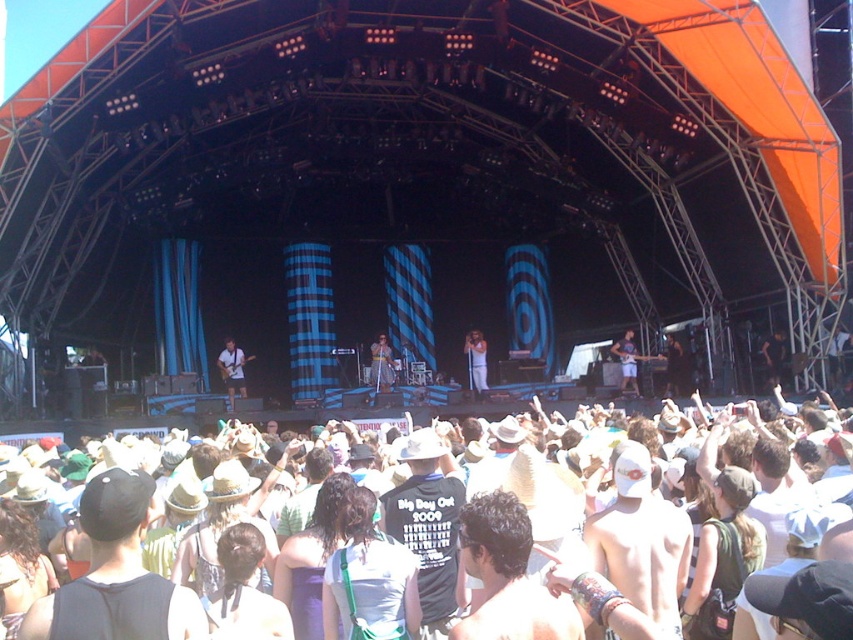
The height and width of the screenshot is (640, 853). What do you see at coordinates (231, 371) in the screenshot?
I see `matte white guitar at center` at bounding box center [231, 371].

Who is taller, matte white guitar at center or shiny silver guitar at center?

matte white guitar at center is taller.

Is point (242, 397) positioned after point (772, 362)?

No, it is in front of (772, 362).

At what (x,y) coordinates should I click in order to perform the action: click on matte white guitar at center. Please return your answer as a coordinate pair (x, y). Image resolution: width=853 pixels, height=640 pixels. Looking at the image, I should click on (231, 371).

Does white cotton crowd at center appear on the left side of white fabric shirt at center?

In fact, white cotton crowd at center is to the right of white fabric shirt at center.

Is white cotton crowd at center bigger than white fabric shirt at center?

Indeed, white cotton crowd at center has a larger size compared to white fabric shirt at center.

Image resolution: width=853 pixels, height=640 pixels. In order to click on white cotton crowd at center in this screenshot , I will do `click(752, 492)`.

Where is `white cotton crowd at center`? white cotton crowd at center is located at coordinates (752, 492).

Measure the distance between point (607, 433) and camera.

Point (607, 433) is 75.18 meters from camera.

Is white cotton crowd at center taller than shiny silver microphone at center?

Indeed, white cotton crowd at center has a greater height compared to shiny silver microphone at center.

This screenshot has height=640, width=853. What do you see at coordinates (752, 492) in the screenshot?
I see `white cotton crowd at center` at bounding box center [752, 492].

Locate an element on the screen. The height and width of the screenshot is (640, 853). white cotton crowd at center is located at coordinates (752, 492).